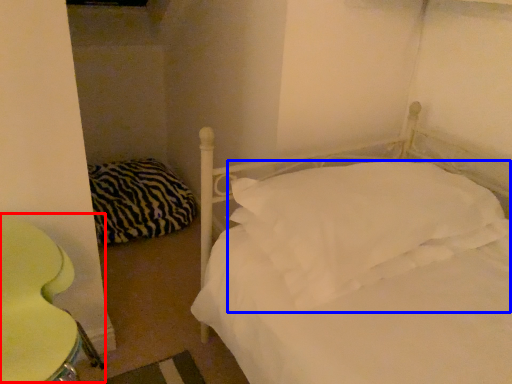
Question: Among these objects, which one is farthest to the camera, swivel chair (highlighted by a red box) or pillow (highlighted by a blue box)?

Choices:
 (A) swivel chair
 (B) pillow

Answer: (B)